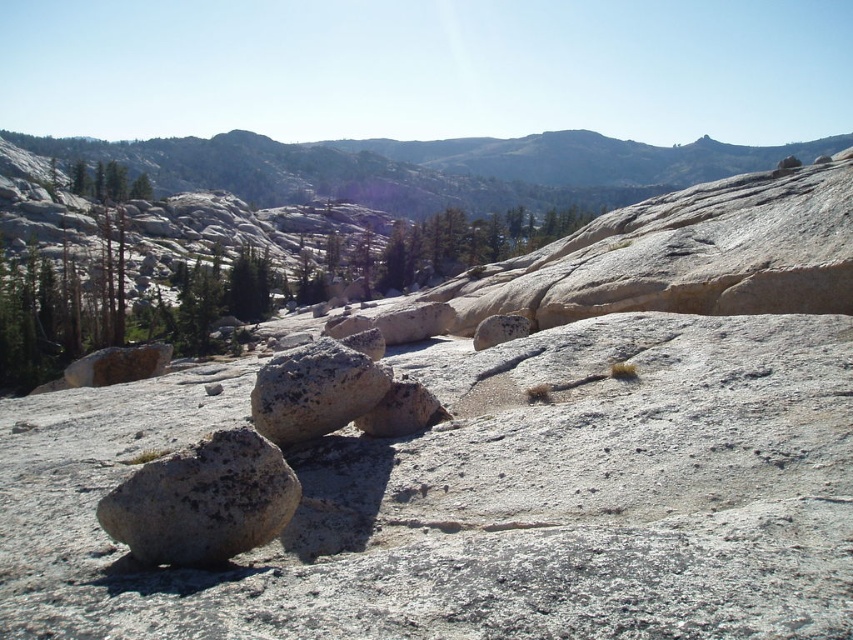
You are a hiker planning to walk from the rusty metallic rock at left to the green matte tree at upper left. Which object will you encounter first?

You will encounter the rusty metallic rock at left first because it is closer to you than the green matte tree at upper left.